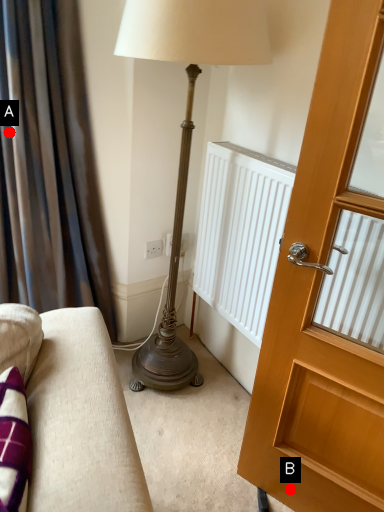
Question: Two points are circled on the image, labeled by A and B beside each circle. Which point is closer to the camera taking this photo?

Choices:
 (A) A is closer
 (B) B is closer

Answer: (B)